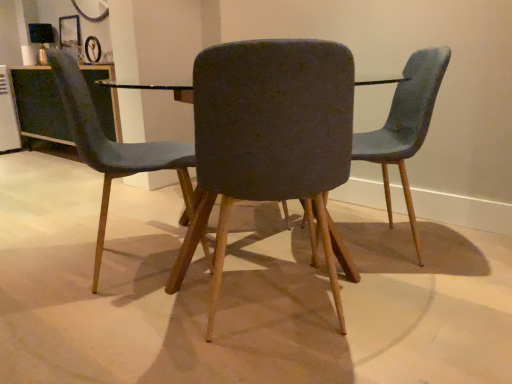
Find the location of a particular element. The width and height of the screenshot is (512, 384). free space in front of textured gray chair at center, placed as the 3th chair when sorted from left to right is located at coordinates (414, 304).